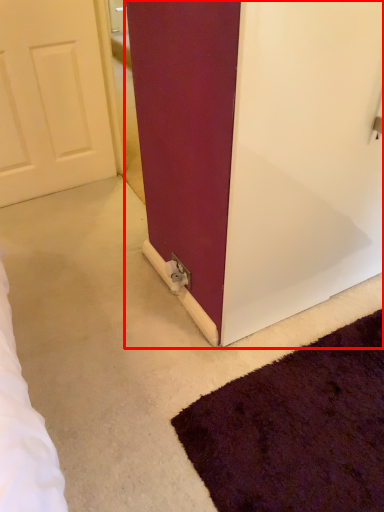
Question: Where is door (annotated by the red box) located in relation to electric outlet in the image?

Choices:
 (A) left
 (B) right

Answer: (B)